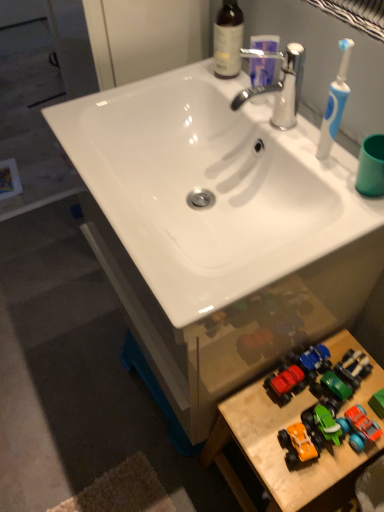
You are a GUI agent. You are given a task and a screenshot of the screen. Output one action in this format:
    pyautogui.click(x=<x>, y=<y>)
    Task: Click on the vacant space positioned to the left of brown glass bottle at upper center
    
    Given the screenshot: What is the action you would take?
    pyautogui.click(x=178, y=78)